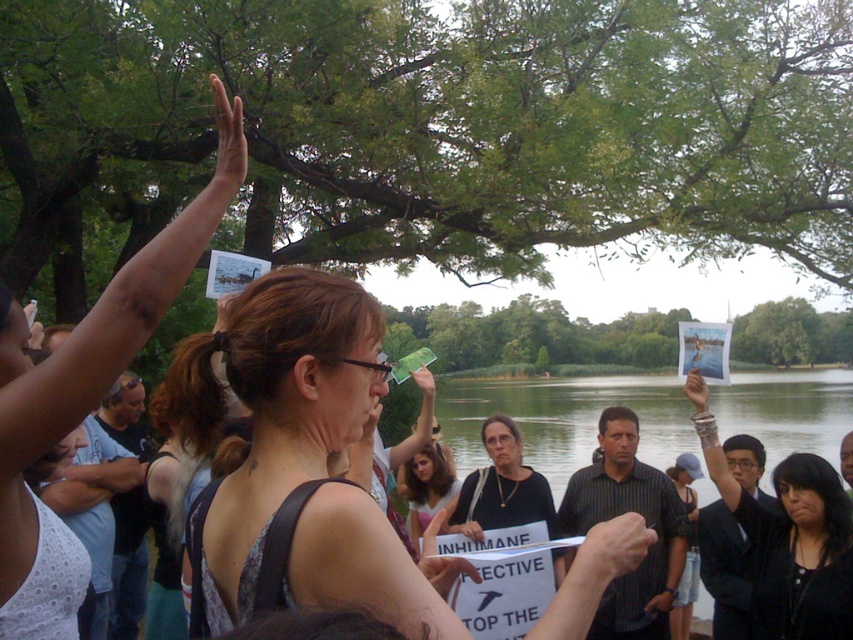
In the scene shown: Can you confirm if green leafy tree at upper center is positioned to the right of black fabric shirt at upper center?

No, green leafy tree at upper center is not to the right of black fabric shirt at upper center.

Does green leafy tree at upper center appear on the left side of black fabric shirt at upper center?

Correct, you'll find green leafy tree at upper center to the left of black fabric shirt at upper center.

Image resolution: width=853 pixels, height=640 pixels. In order to click on green leafy tree at upper center in this screenshot , I will do `click(432, 129)`.

Which is above, black fabric shirt at upper center or denim shorts at lower right?

black fabric shirt at upper center

Between point (836, 476) and point (688, 557), which one is positioned behind?

Positioned behind is point (688, 557).

Which is behind, point (688, 388) or point (677, 604)?

The point (677, 604) is behind.

The height and width of the screenshot is (640, 853). I want to click on black fabric shirt at upper center, so click(788, 538).

The image size is (853, 640). Describe the element at coordinates (195, 420) in the screenshot. I see `brown hair at center` at that location.

Who is lower down, brown hair at center or matte black shirt at center?

matte black shirt at center is below.

Between point (172, 504) and point (442, 481), which one is positioned in front?

Point (172, 504) is more forward.

I want to click on brown hair at center, so click(195, 420).